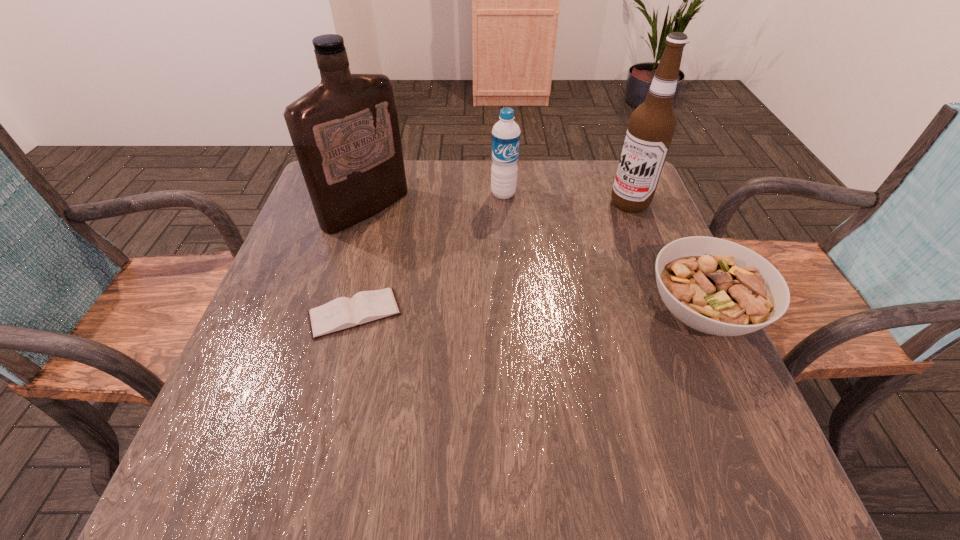
Find the location of a particular element. Image resolution: width=960 pixels, height=540 pixels. the shortest object is located at coordinates (342, 313).

Locate an element on the screen. This screenshot has width=960, height=540. the fourth tallest object is located at coordinates [715, 286].

Where is `the third tallest object`? the third tallest object is located at coordinates (505, 142).

I want to click on the third object from right to left, so click(x=505, y=142).

You are a GUI agent. You are given a task and a screenshot of the screen. Output one action in this format:
    pyautogui.click(x=<x>, y=<y>)
    Task: Click on the liquor
    
    Given the screenshot: What is the action you would take?
    pyautogui.click(x=345, y=131)

This screenshot has width=960, height=540. In order to click on alcohol in this screenshot , I will do `click(652, 125)`.

Where is `free space located on the back of the shortest object`? The height and width of the screenshot is (540, 960). free space located on the back of the shortest object is located at coordinates (376, 228).

Image resolution: width=960 pixels, height=540 pixels. Find the location of `vacant space situated on the front of the stew`. vacant space situated on the front of the stew is located at coordinates (753, 427).

Find the location of a particular element. The width and height of the screenshot is (960, 540). vacant space situated on the label of the third object from left to right is located at coordinates click(506, 215).

Where is `vacant region located on the label of the third object from left to right`? vacant region located on the label of the third object from left to right is located at coordinates (510, 258).